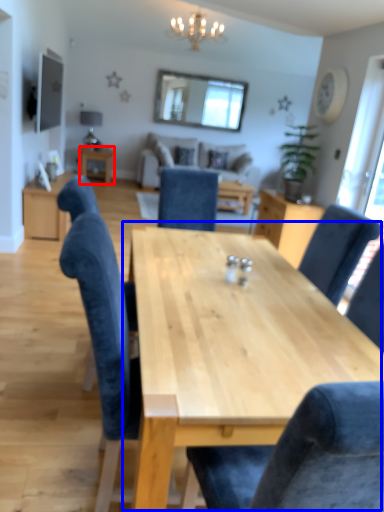
Question: Which point is closer to the camera, table (highlighted by a red box) or table (highlighted by a blue box)?

Choices:
 (A) table
 (B) table

Answer: (B)